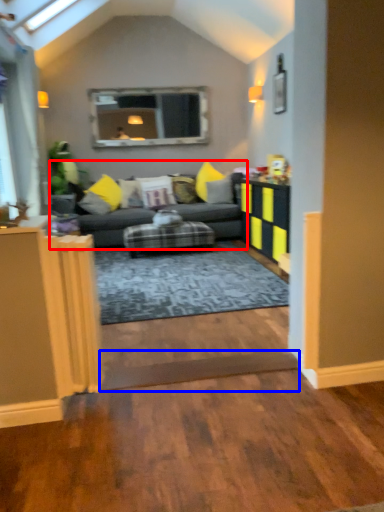
Question: Which object is closer to the camera taking this photo, studio couch (highlighted by a red box) or plank (highlighted by a blue box)?

Choices:
 (A) studio couch
 (B) plank

Answer: (B)